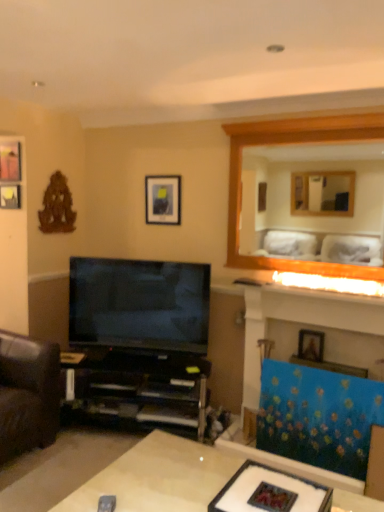
Question: Can you see matte black picture frame at upper left, which is the 2th picture frame from top to bottom, touching wooden picture frame at upper right, the 4th picture frame viewed from the left?

Choices:
 (A) yes
 (B) no

Answer: (B)

Question: Does matte black picture frame at upper left, marked as the second picture frame in a back-to-front arrangement, have a lesser height compared to wooden picture frame at upper right, which is the fourth picture frame in back-to-front order?

Choices:
 (A) no
 (B) yes

Answer: (B)

Question: Is matte black picture frame at upper left, the third picture frame positioned from the bottom, in front of wooden picture frame at upper right, marked as the first picture frame in a right-to-left arrangement?

Choices:
 (A) no
 (B) yes

Answer: (A)

Question: Is matte black picture frame at upper left, the 4th picture frame in the right-to-left sequence, outside wooden picture frame at upper right, which ranks as the first picture frame in bottom-to-top order?

Choices:
 (A) yes
 (B) no

Answer: (A)

Question: Is matte black picture frame at upper left, the 4th picture frame in the right-to-left sequence, thinner than wooden picture frame at upper right, which is the fourth picture frame in back-to-front order?

Choices:
 (A) no
 (B) yes

Answer: (B)

Question: Does matte black picture frame at upper left, which is the 2th picture frame from top to bottom, lie behind wooden picture frame at upper right, marked as the 1th picture frame in a front-to-back arrangement?

Choices:
 (A) no
 (B) yes

Answer: (B)

Question: From the image's perspective, is black plastic shelf at lower left above matte black tv at center?

Choices:
 (A) no
 (B) yes

Answer: (A)

Question: Could you tell me if black plastic shelf at lower left is turned towards matte black tv at center?

Choices:
 (A) no
 (B) yes

Answer: (A)

Question: Is the surface of black plastic shelf at lower left in direct contact with matte black tv at center?

Choices:
 (A) no
 (B) yes

Answer: (A)

Question: From a real-world perspective, is black plastic shelf at lower left on top of matte black tv at center?

Choices:
 (A) yes
 (B) no

Answer: (B)

Question: Is matte black tv at center at the back of black plastic shelf at lower left?

Choices:
 (A) no
 (B) yes

Answer: (A)

Question: Does black plastic shelf at lower left have a larger size compared to matte black tv at center?

Choices:
 (A) yes
 (B) no

Answer: (A)

Question: Does wooden picture frame at upper right, which is the fourth picture frame in back-to-front order, have a smaller size compared to matte glass frame at center?

Choices:
 (A) no
 (B) yes

Answer: (B)